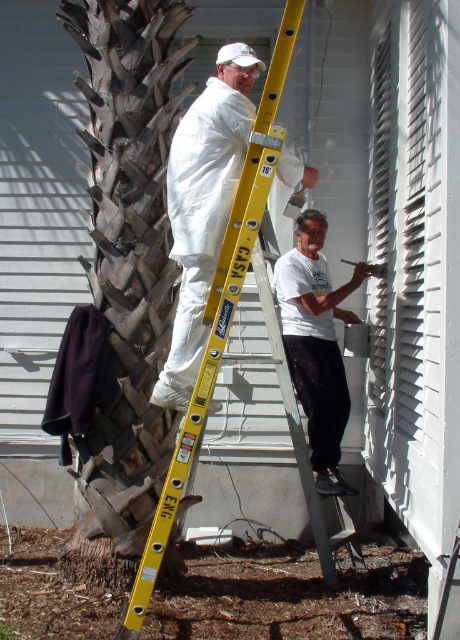
Question: Considering the real-world distances, which object is farthest from the dark brown textured bark at left?

Choices:
 (A) yellow metallic ladder at center
 (B) white matte coveralls at center
 (C) white matte shirt at lower center

Answer: (C)

Question: Can you confirm if dark brown textured bark at left is bigger than white matte coveralls at center?

Choices:
 (A) no
 (B) yes

Answer: (B)

Question: Which of the following is the closest to the observer?

Choices:
 (A) dark brown textured bark at left
 (B) white matte coveralls at center
 (C) yellow metallic ladder at center

Answer: (C)

Question: Which object is farther from the camera taking this photo?

Choices:
 (A) white matte shirt at lower center
 (B) dark brown textured bark at left
 (C) white matte coveralls at center
 (D) yellow metallic ladder at center

Answer: (A)

Question: Does dark brown textured bark at left have a lesser width compared to yellow metallic ladder at center?

Choices:
 (A) no
 (B) yes

Answer: (A)

Question: Is yellow metallic ladder at center bigger than white matte shirt at lower center?

Choices:
 (A) yes
 (B) no

Answer: (A)